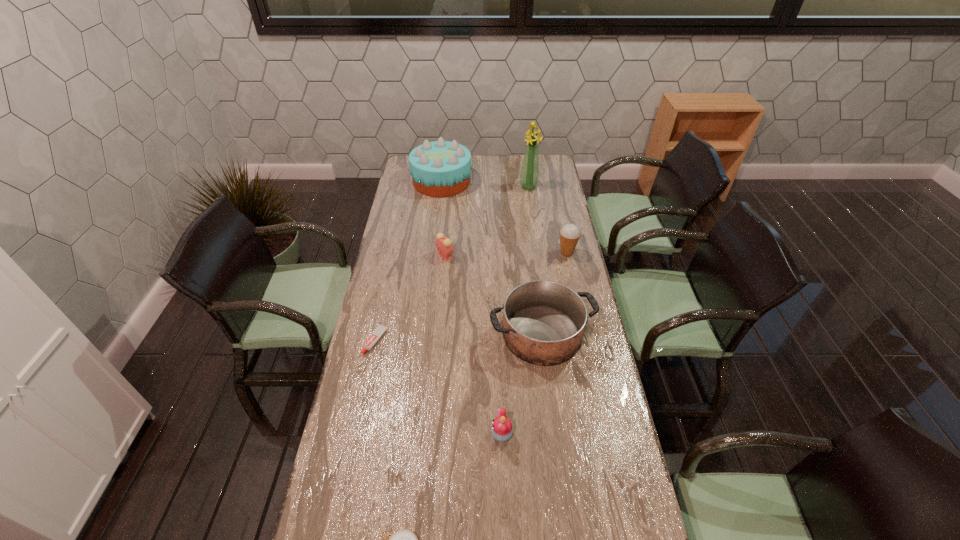
Find the location of a particular element. This screenshot has width=960, height=540. the tallest object is located at coordinates (529, 176).

Locate an element on the screen. Image resolution: width=960 pixels, height=540 pixels. cake is located at coordinates (441, 168).

Identify the location of icecream. (569, 234).

Locate an element on the screen. saucepan is located at coordinates (543, 321).

What are the coordinates of `alarm clock` in the screenshot? It's located at (444, 246).

The width and height of the screenshot is (960, 540). What are the coordinates of `cupcake` in the screenshot? It's located at (502, 430).

Where is `the seventh tallest object`? the seventh tallest object is located at coordinates (380, 329).

Identify the location of free point located on the front-facing side of the tallest object. This screenshot has height=540, width=960. (535, 226).

This screenshot has height=540, width=960. In order to click on vacant space located on the back of the seventh shortest object in this screenshot , I will do `click(444, 159)`.

At what (x,y) coordinates should I click in order to perform the action: click on vacant position located on the back of the icecream. Please return your answer as a coordinate pair (x, y). Image resolution: width=960 pixels, height=540 pixels. Looking at the image, I should click on (562, 228).